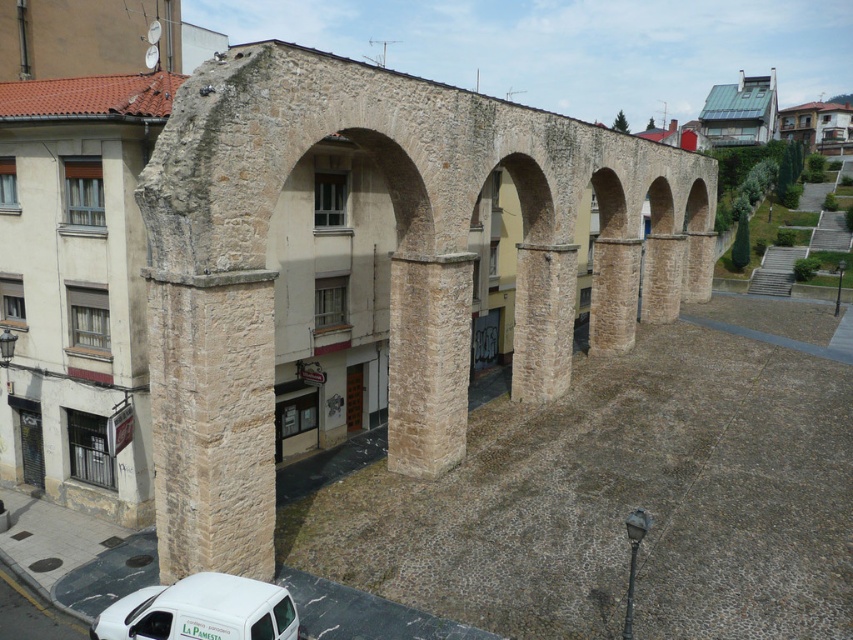
Between natural stone viaduct at center and white matte van at lower left, which one has less height?

white matte van at lower left is shorter.

Is natural stone viaduct at center further to camera compared to white matte van at lower left?

Yes.

Locate an element on the screen. The height and width of the screenshot is (640, 853). natural stone viaduct at center is located at coordinates (390, 268).